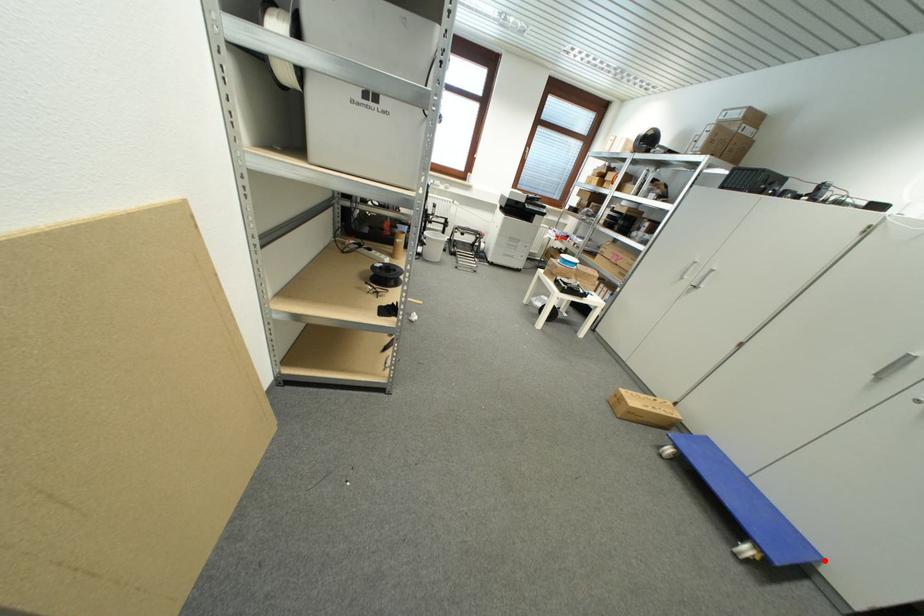
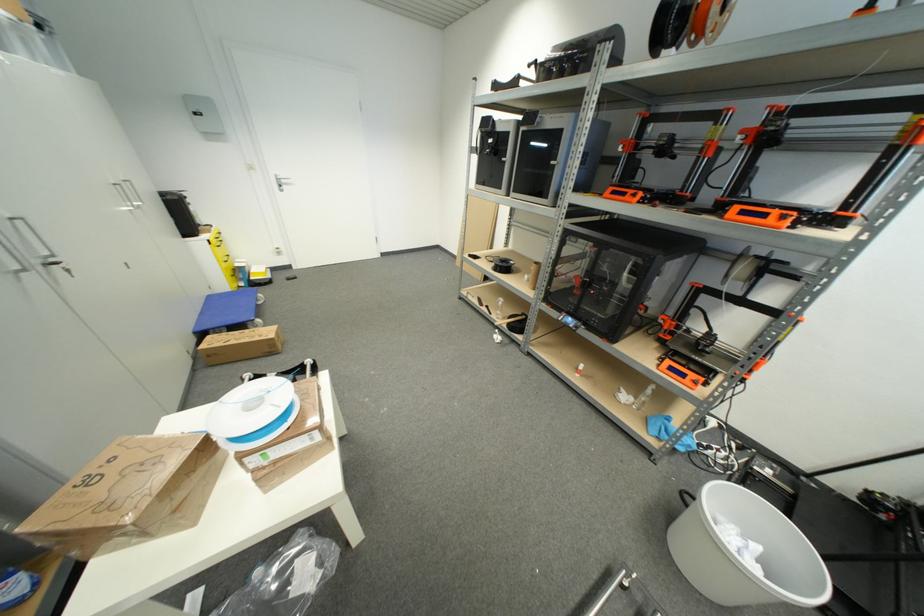
Question: I am providing you with two images of the same scene from different viewpoints. In image1, a red point is highlighted. Considering the same 3D point in image2, which of the following is correct?

Choices:
 (A) It is closer
 (B) It is farther

Answer: (A)